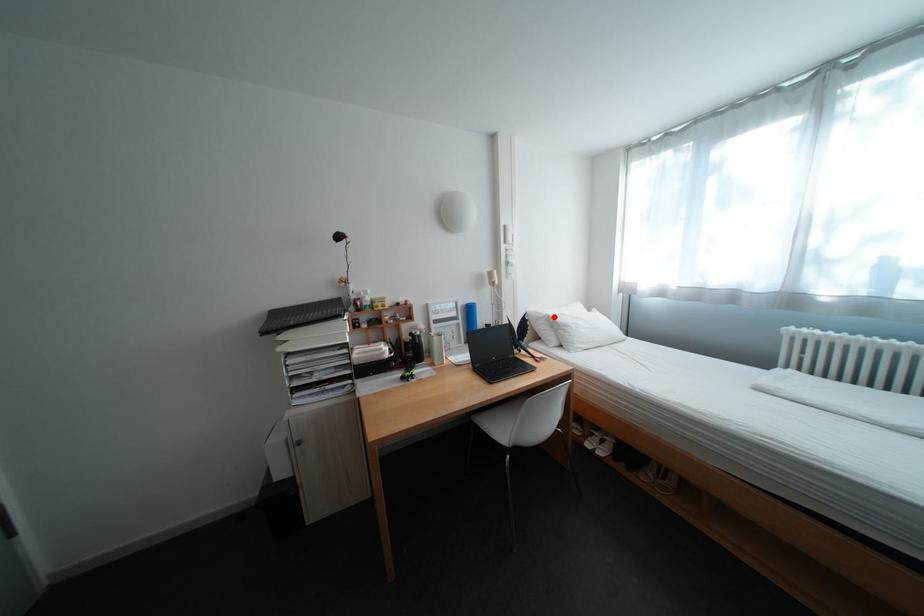
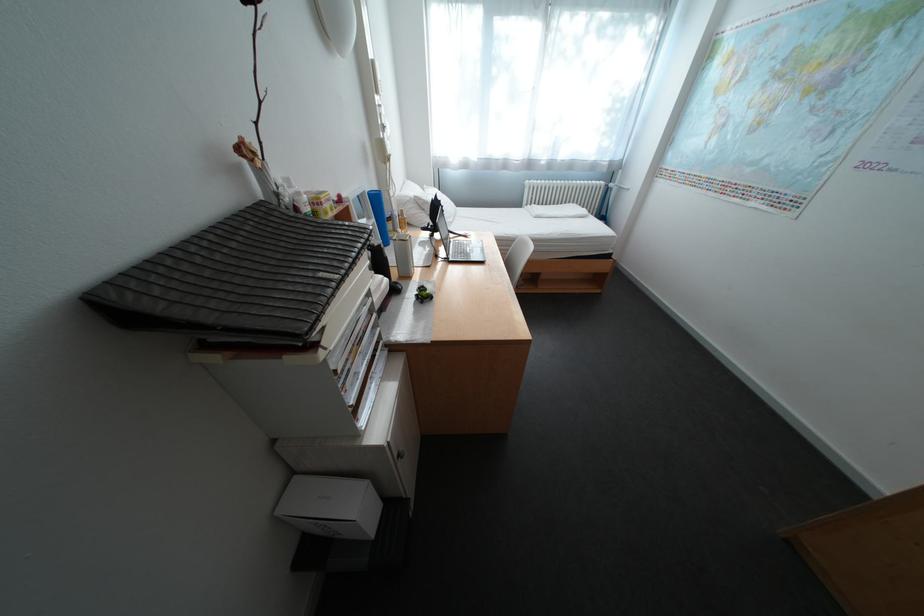
Find the pixel in the second image that matches the highlighted location in the first image.

(420, 200)